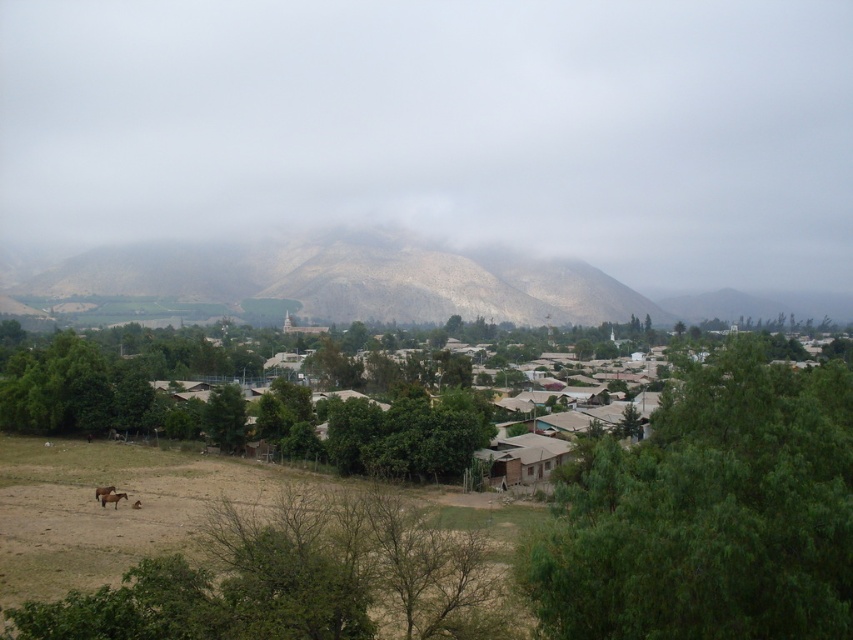
In the scene shown: Is green matte tree at center to the left of brown fuzzy horse at lower left from the viewer's perspective?

Incorrect, green matte tree at center is not on the left side of brown fuzzy horse at lower left.

Between green matte tree at center and brown fuzzy horse at lower left, which one is positioned lower?

brown fuzzy horse at lower left is below.

What are the coordinates of `green matte tree at center` in the screenshot? It's located at (225, 417).

At what (x,y) coordinates should I click in order to perform the action: click on green matte tree at center. Please return your answer as a coordinate pair (x, y). The image size is (853, 640). Looking at the image, I should click on (225, 417).

Is the position of green leafy tree at center right more distant than that of brown matte horse at lower left?

No, green leafy tree at center right is in front of brown matte horse at lower left.

Which is more to the left, green leafy tree at center right or brown matte horse at lower left?

brown matte horse at lower left

Does point (750, 528) lie behind point (102, 488)?

No, it is not.

I want to click on green leafy tree at center right, so click(709, 515).

Does point (32, 262) come farther from viewer compared to point (549, 438)?

Yes.

Can you confirm if desert-like brown mountain at center is thinner than brown corrugated metal hut at lower right?

No, desert-like brown mountain at center is not thinner than brown corrugated metal hut at lower right.

The height and width of the screenshot is (640, 853). What do you see at coordinates (344, 280) in the screenshot?
I see `desert-like brown mountain at center` at bounding box center [344, 280].

What are the coordinates of `desert-like brown mountain at center` in the screenshot? It's located at (344, 280).